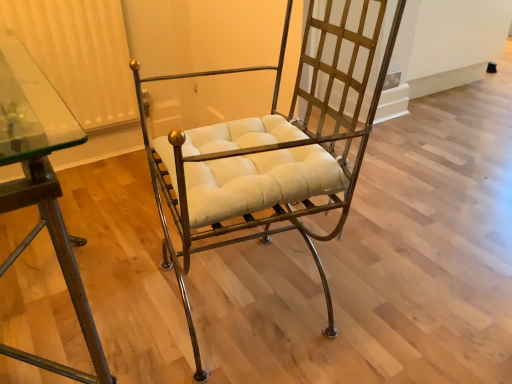
What do you see at coordinates (268, 154) in the screenshot? The height and width of the screenshot is (384, 512). I see `metallic gold chair at center` at bounding box center [268, 154].

This screenshot has width=512, height=384. I want to click on metallic gold chair at center, so [268, 154].

In order to click on metallic gold chair at center in this screenshot , I will do `click(268, 154)`.